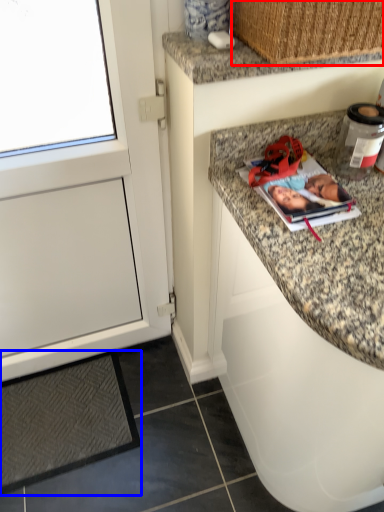
Question: Which object appears farthest to the camera in this image, basket (highlighted by a red box) or mat (highlighted by a blue box)?

Choices:
 (A) basket
 (B) mat

Answer: (B)